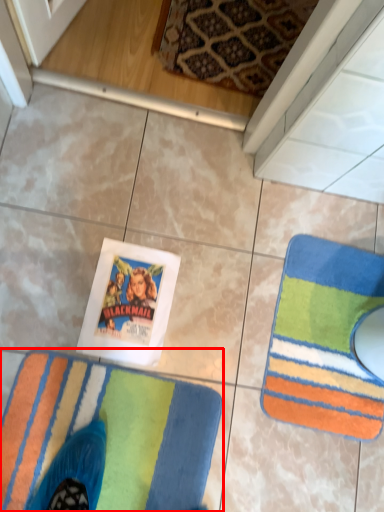
Question: From the image's perspective, where is towel (annotated by the red box) located relative to towel?

Choices:
 (A) above
 (B) below

Answer: (B)